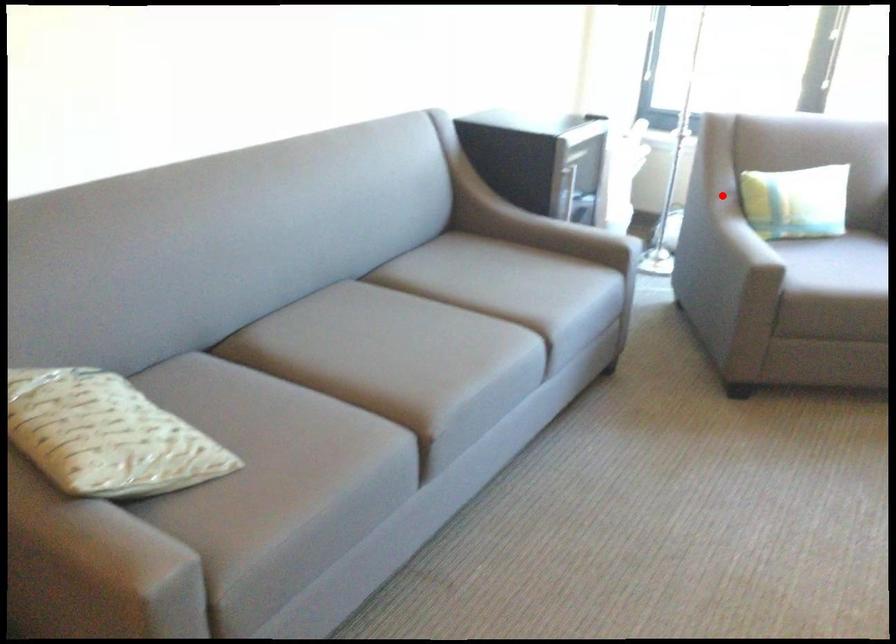
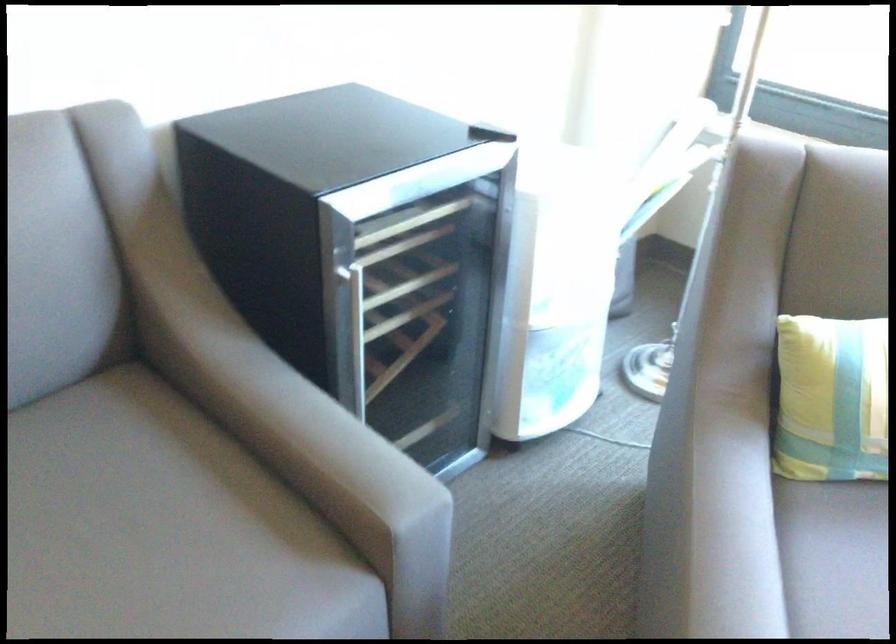
Question: I am providing you with two images of the same scene from different viewpoints. A red point is marked on the first image. Can you still see the location of the red point in image 2?

Choices:
 (A) Yes
 (B) No

Answer: (A)